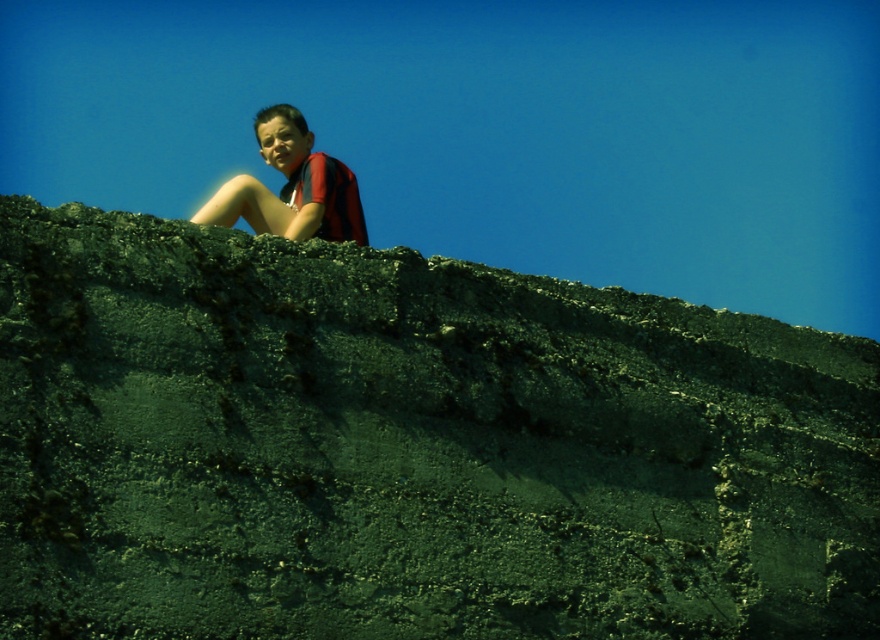
Question: Is dark gray textured rock at upper center positioned behind matte red shirt at upper center?

Choices:
 (A) yes
 (B) no

Answer: (B)

Question: Which point is closer to the camera taking this photo?

Choices:
 (A) (353, 208)
 (B) (270, 436)

Answer: (B)

Question: Which of the following is the farthest from the observer?

Choices:
 (A) (252, 182)
 (B) (380, 564)

Answer: (A)

Question: Can you confirm if dark gray textured rock at upper center is positioned to the right of matte red shirt at upper center?

Choices:
 (A) yes
 (B) no

Answer: (A)

Question: Does dark gray textured rock at upper center have a greater width compared to matte red shirt at upper center?

Choices:
 (A) yes
 (B) no

Answer: (A)